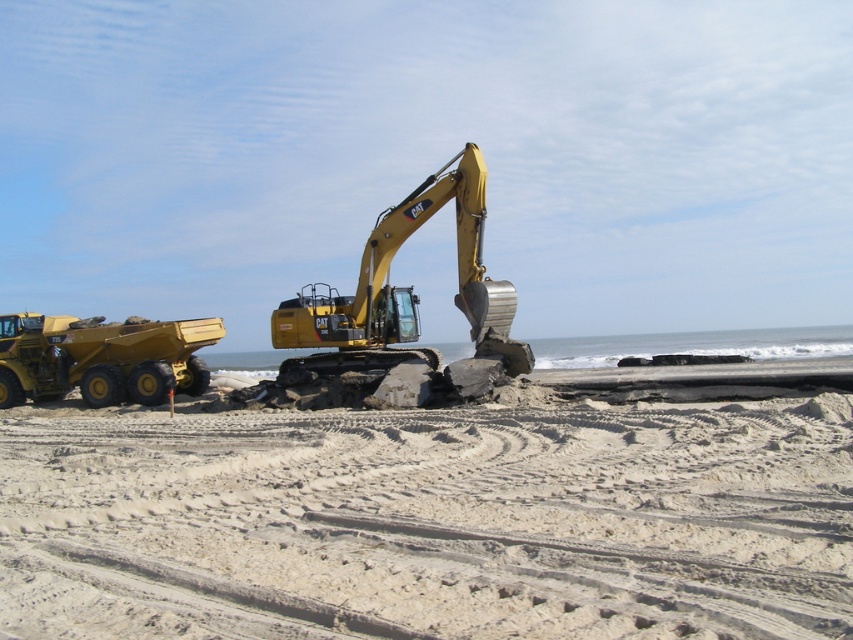
Question: Does yellow metallic excavator at center have a smaller size compared to matte yellow dump truck at left?

Choices:
 (A) yes
 (B) no

Answer: (B)

Question: Which point appears closest to the camera in this image?

Choices:
 (A) pyautogui.click(x=321, y=636)
 (B) pyautogui.click(x=184, y=387)
 (C) pyautogui.click(x=361, y=346)

Answer: (A)

Question: Which object is farther from the camera taking this photo?

Choices:
 (A) white sandy beach at center
 (B) yellow metallic excavator at center
 (C) matte yellow dump truck at left

Answer: (C)

Question: Among these points, which one is farthest from the camera?

Choices:
 (A) (51, 456)
 (B) (480, 348)
 (C) (114, 397)

Answer: (C)

Question: Does white sandy beach at center appear under yellow metallic excavator at center?

Choices:
 (A) yes
 (B) no

Answer: (A)

Question: Can you confirm if white sandy beach at center is bigger than matte yellow dump truck at left?

Choices:
 (A) yes
 (B) no

Answer: (A)